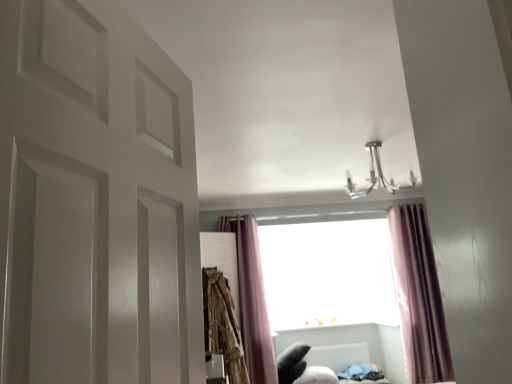
Describe the element at coordinates (419, 297) in the screenshot. I see `purple velvet curtain at center, the 1th curtain in the right-to-left sequence` at that location.

Find the location of `white plastic radiator at lower center`. white plastic radiator at lower center is located at coordinates (338, 355).

Image resolution: width=512 pixels, height=384 pixels. What are the coordinates of `white matte door at left` in the screenshot? It's located at (95, 200).

The image size is (512, 384). Find the location of `textured beige robe at center-left`. textured beige robe at center-left is located at coordinates (222, 325).

What do you see at coordinates (222, 325) in the screenshot? I see `textured beige robe at center-left` at bounding box center [222, 325].

You are a GUI agent. You are given a task and a screenshot of the screen. Output one action in this format:
    pyautogui.click(x=<x>, y=<y>)
    Task: Click on the purple velvet curtain at center, the 1th curtain in the right-to-left sequence
    
    Given the screenshot: What is the action you would take?
    pyautogui.click(x=419, y=297)

Does purple velvet curtain at center, positioned as the second curtain in right-to-left order, have a smaller size compared to white plastic radiator at lower center?

Actually, purple velvet curtain at center, positioned as the second curtain in right-to-left order, might be larger than white plastic radiator at lower center.

The height and width of the screenshot is (384, 512). In order to click on radiator that is below the purple velvet curtain at center, placed as the 1th curtain when sorted from left to right (from the image's perspective) in this screenshot , I will do `click(338, 355)`.

From a real-world perspective, between purple velvet curtain at center, positioned as the second curtain in right-to-left order, and white plastic radiator at lower center, who is vertically lower?

From a 3D spatial view, white plastic radiator at lower center is below.

Measure the distance between purple velvet curtain at center, positioned as the second curtain in right-to-left order, and white plastic radiator at lower center.

4.49 feet.

Which is more to the left, purple velvet curtain at center, the 1th curtain in the right-to-left sequence, or chrome metallic chandelier at upper center?

Positioned to the left is chrome metallic chandelier at upper center.

Is purple velvet curtain at center, the 1th curtain in the right-to-left sequence, in contact with chrome metallic chandelier at upper center?

There is a gap between purple velvet curtain at center, the 1th curtain in the right-to-left sequence, and chrome metallic chandelier at upper center.

Looking at this image, could you tell me if purple velvet curtain at center, the 2th curtain viewed from the left, is facing chrome metallic chandelier at upper center?

No, purple velvet curtain at center, the 2th curtain viewed from the left, does not turn towards chrome metallic chandelier at upper center.

Between point (402, 318) and point (412, 186), which one is positioned behind?

Positioned behind is point (402, 318).

Considering the sizes of textured beige robe at center-left and transparent glass window at center in the image, is textured beige robe at center-left taller or shorter than transparent glass window at center?

Clearly, textured beige robe at center-left is shorter compared to transparent glass window at center.

Is transparent glass window at center surrounded by textured beige robe at center-left?

Actually, transparent glass window at center is outside textured beige robe at center-left.

From a real-world perspective, is textured beige robe at center-left positioned above or below transparent glass window at center?

From a real-world perspective, textured beige robe at center-left is physically below transparent glass window at center.

The width and height of the screenshot is (512, 384). Identify the location of robe on the left of the transparent glass window at center. (222, 325).

From the picture: From a real-world perspective, between purple velvet curtain at center, the 2th curtain viewed from the left, and transparent glass window at center, who is vertically lower?

purple velvet curtain at center, the 2th curtain viewed from the left.

Considering the positions of objects purple velvet curtain at center, the 1th curtain in the right-to-left sequence, and transparent glass window at center in the image provided, who is more to the left, purple velvet curtain at center, the 1th curtain in the right-to-left sequence, or transparent glass window at center?

Positioned to the left is transparent glass window at center.

Is purple velvet curtain at center, the 1th curtain in the right-to-left sequence, taller than transparent glass window at center?

Yes.

Locate an element on the screen. This screenshot has width=512, height=384. window that appears on the left of purple velvet curtain at center, the 2th curtain viewed from the left is located at coordinates (328, 274).

From the image's perspective, between chrome metallic chandelier at upper center and purple velvet curtain at center, the 1th curtain in the right-to-left sequence, who is located below?

purple velvet curtain at center, the 1th curtain in the right-to-left sequence.

Is chrome metallic chandelier at upper center placed right next to purple velvet curtain at center, the 2th curtain viewed from the left?

No, chrome metallic chandelier at upper center is not making contact with purple velvet curtain at center, the 2th curtain viewed from the left.

Considering the relative sizes of chrome metallic chandelier at upper center and purple velvet curtain at center, the 2th curtain viewed from the left, in the image provided, is chrome metallic chandelier at upper center thinner than purple velvet curtain at center, the 2th curtain viewed from the left,?

In fact, chrome metallic chandelier at upper center might be wider than purple velvet curtain at center, the 2th curtain viewed from the left.

Does chrome metallic chandelier at upper center have a greater height compared to purple velvet curtain at center, the 2th curtain viewed from the left?

In fact, chrome metallic chandelier at upper center may be shorter than purple velvet curtain at center, the 2th curtain viewed from the left.

From a real-world perspective, which is physically above, transparent glass window at center or chrome metallic chandelier at upper center?

chrome metallic chandelier at upper center.

Which is correct: transparent glass window at center is inside chrome metallic chandelier at upper center, or outside of it?

transparent glass window at center is outside chrome metallic chandelier at upper center.

From the image's perspective, is transparent glass window at center on chrome metallic chandelier at upper center?

No, from the image's perspective, transparent glass window at center is not over chrome metallic chandelier at upper center.

Does transparent glass window at center have a smaller size compared to chrome metallic chandelier at upper center?

Yes, transparent glass window at center is smaller than chrome metallic chandelier at upper center.

Does purple velvet curtain at center, placed as the 1th curtain when sorted from left to right, have a lesser height compared to white matte door at left?

In fact, purple velvet curtain at center, placed as the 1th curtain when sorted from left to right, may be taller than white matte door at left.

Who is smaller, purple velvet curtain at center, positioned as the second curtain in right-to-left order, or white matte door at left?

white matte door at left.

Is purple velvet curtain at center, placed as the 1th curtain when sorted from left to right, far from white matte door at left?

Yes, purple velvet curtain at center, placed as the 1th curtain when sorted from left to right, and white matte door at left are quite far apart.

At what (x,y) coordinates should I click in order to perform the action: click on radiator located underneath the purple velvet curtain at center, placed as the 1th curtain when sorted from left to right (from a real-world perspective). Please return your answer as a coordinate pair (x, y). This screenshot has width=512, height=384. Looking at the image, I should click on (338, 355).

The height and width of the screenshot is (384, 512). In order to click on light fixture in front of the purple velvet curtain at center, the 2th curtain viewed from the left in this screenshot , I will do `click(372, 175)`.

In the scene shown: Estimate the real-world distances between objects in this image. Which object is further from purple velvet curtain at center, positioned as the second curtain in right-to-left order, white matte door at left or transparent glass window at center?

white matte door at left.

Looking at the image, which one is located closer to chrome metallic chandelier at upper center, white matte door at left or purple velvet curtain at center, the 2th curtain viewed from the left?

purple velvet curtain at center, the 2th curtain viewed from the left, lies closer to chrome metallic chandelier at upper center than the other object.

Which object lies nearer to the anchor point purple velvet curtain at center, the 2th curtain viewed from the left, transparent glass window at center or white plastic radiator at lower center?

transparent glass window at center lies closer to purple velvet curtain at center, the 2th curtain viewed from the left, than the other object.

Looking at the image, which one is located closer to white matte door at left, purple velvet curtain at center, positioned as the second curtain in right-to-left order, or white plastic radiator at lower center?

purple velvet curtain at center, positioned as the second curtain in right-to-left order, is closer to white matte door at left.

From the image, which object appears to be nearer to chrome metallic chandelier at upper center, purple velvet curtain at center, placed as the 1th curtain when sorted from left to right, or white matte door at left?

purple velvet curtain at center, placed as the 1th curtain when sorted from left to right, is positioned closer to the anchor chrome metallic chandelier at upper center.

When comparing their distances from transparent glass window at center, does textured beige robe at center-left or white matte door at left seem further?

white matte door at left is positioned further to the anchor transparent glass window at center.

When comparing their distances from purple velvet curtain at center, placed as the 1th curtain when sorted from left to right, does chrome metallic chandelier at upper center or transparent glass window at center seem closer?

Based on the image, transparent glass window at center appears to be nearer to purple velvet curtain at center, placed as the 1th curtain when sorted from left to right.

When comparing their distances from white plastic radiator at lower center, does textured beige robe at center-left or purple velvet curtain at center, positioned as the second curtain in right-to-left order, seem closer?

purple velvet curtain at center, positioned as the second curtain in right-to-left order, is positioned closer to the anchor white plastic radiator at lower center.

This screenshot has width=512, height=384. Identify the location of light fixture situated between textured beige robe at center-left and purple velvet curtain at center, the 1th curtain in the right-to-left sequence, from left to right. (372, 175).

The height and width of the screenshot is (384, 512). I want to click on light fixture between white matte door at left and textured beige robe at center-left from front to back, so click(372, 175).

The image size is (512, 384). What are the coordinates of `robe positioned between chrome metallic chandelier at upper center and white plastic radiator at lower center from near to far` in the screenshot? It's located at (222, 325).

At what (x,y) coordinates should I click in order to perform the action: click on radiator between white matte door at left and transparent glass window at center in the front-back direction. Please return your answer as a coordinate pair (x, y). The height and width of the screenshot is (384, 512). Looking at the image, I should click on pos(338,355).